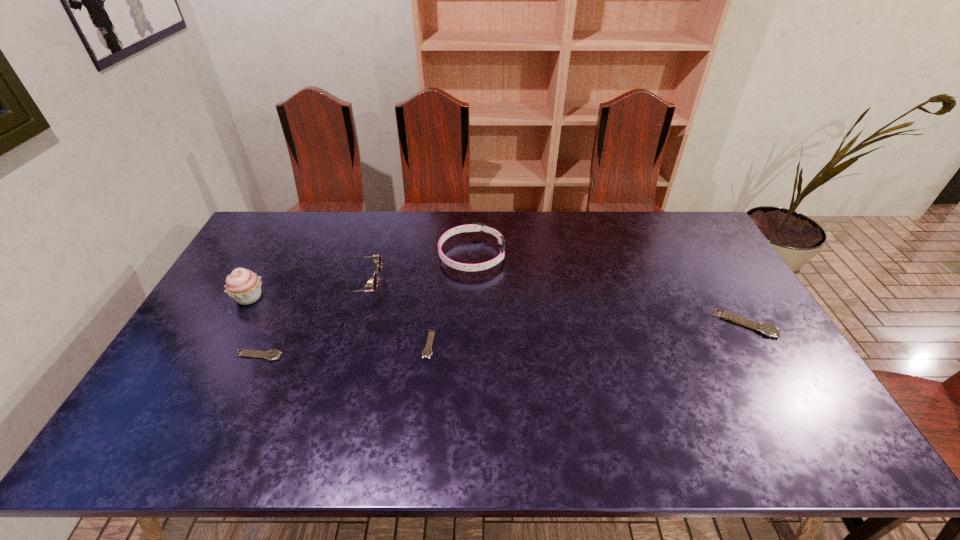
Image resolution: width=960 pixels, height=540 pixels. Identify the location of free region at the far edge. (330, 224).

Identify the location of free space at the near edge of the desktop. (478, 403).

At what (x,y) coordinates should I click in order to perform the action: click on free spot at the left edge of the desktop. Please return your answer as a coordinate pair (x, y). Looking at the image, I should click on (243, 305).

In the image, there is a desktop. At what (x,y) coordinates should I click in order to perform the action: click on vacant space at the right edge. Please return your answer as a coordinate pair (x, y). The width and height of the screenshot is (960, 540). Looking at the image, I should click on (740, 332).

In the image, there is a desktop. At what (x,y) coordinates should I click in order to perform the action: click on vacant space at the far left corner. Please return your answer as a coordinate pair (x, y). The image size is (960, 540). Looking at the image, I should click on click(x=268, y=243).

Where is `vacant space at the far right corner of the desktop`? This screenshot has height=540, width=960. vacant space at the far right corner of the desktop is located at coordinates (701, 240).

Identify the location of blank region between the second shortest watch and the fourth shortest object. (365, 306).

The height and width of the screenshot is (540, 960). What are the coordinates of `unoccupied position between the second watch from right to left and the rightmost object` in the screenshot? It's located at (588, 334).

Find the location of a particular element. vacant area that lies between the second watch from right to left and the second tallest watch is located at coordinates (344, 350).

The image size is (960, 540). In order to click on vacant space in between the tallest object and the second watch from left to right in this screenshot , I will do `click(339, 321)`.